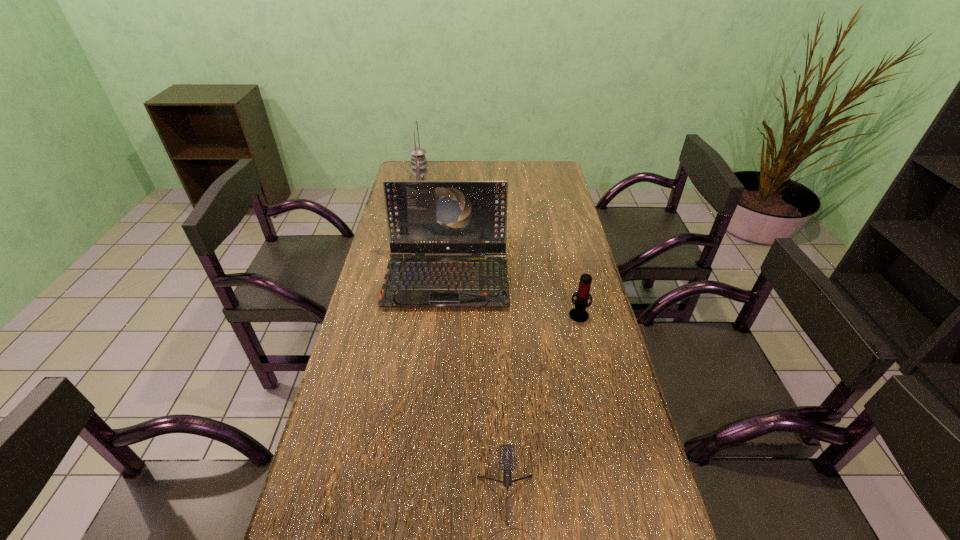
Identify the location of object at the right edge. The image size is (960, 540). (579, 314).

The height and width of the screenshot is (540, 960). In the image, there is a desktop. Identify the location of blank space at the far edge. (521, 163).

Locate an element on the screen. The width and height of the screenshot is (960, 540). vacant space at the left edge of the desktop is located at coordinates (348, 434).

This screenshot has height=540, width=960. I want to click on free space at the right edge of the desktop, so point(534,211).

In the image, there is a desktop. Where is `vacant space at the far right corner`? vacant space at the far right corner is located at coordinates (532, 171).

Choose which object is the nearest neighbor to the laptop computer. Please provide its 2D coordinates. Your answer should be formatted as a tuple, i.e. [(x, y)], where the tuple contains the x and y coordinates of a point satisfying the conditions above.

[(579, 314)]

Identify the location of object that stands as the closest to the oil lamp. (423, 217).

Identify the location of vacant area in the image that satisfies the following two spatial constraints: 1. on the screen of the third shortest object; 2. on the left side of the right microphone. (444, 314).